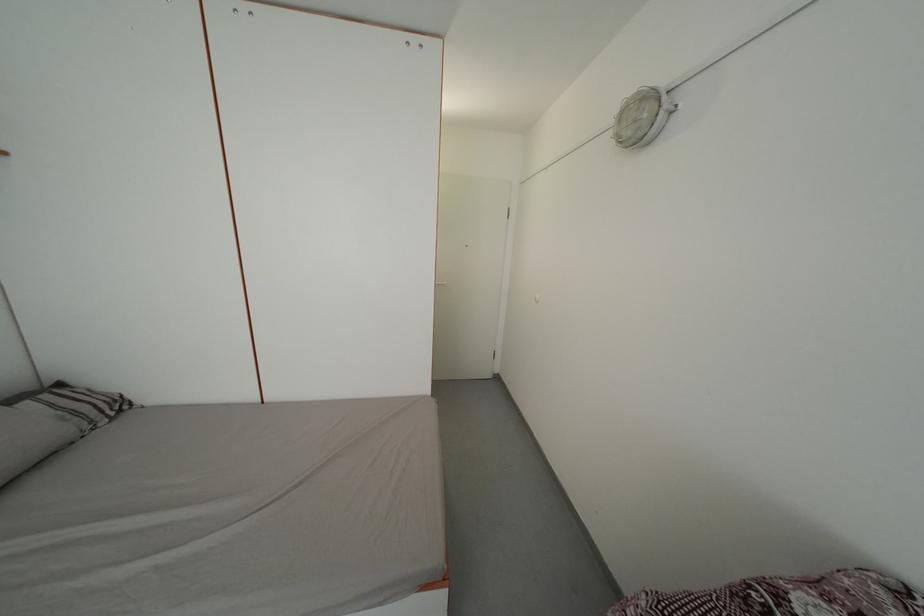
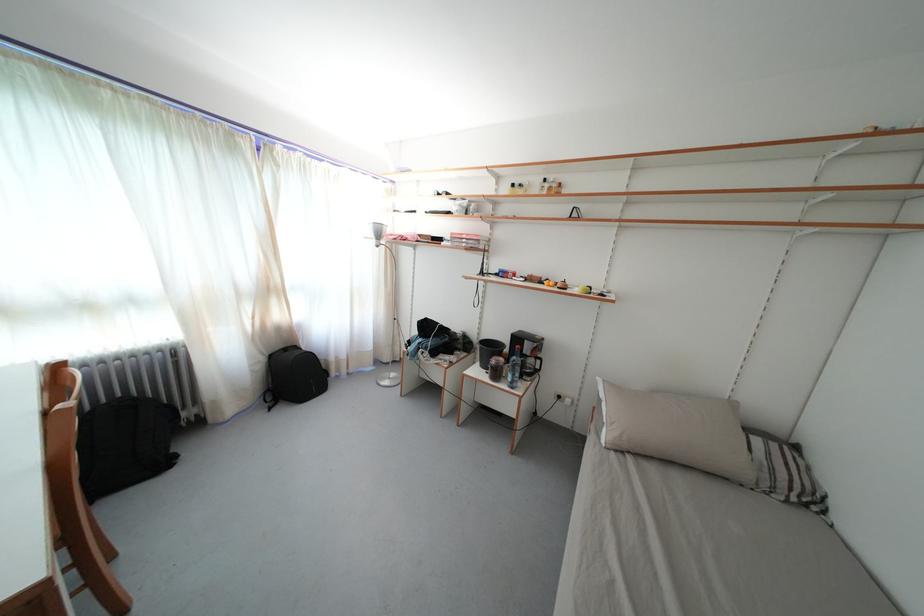
Where in the second image is the point corresponding to the point at 91,415 from the first image?

(788, 482)